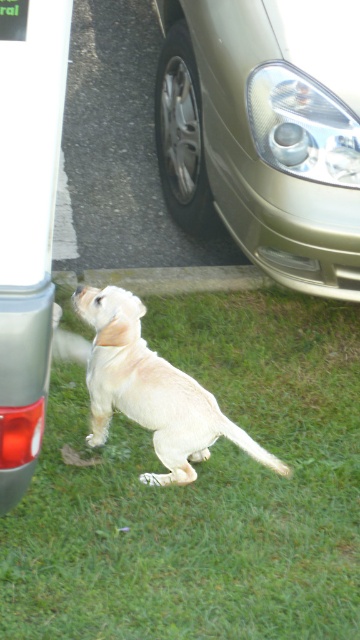
You are a photographer trying to capture the light beige fur dog at center and the gold metallic car at upper center in a single frame. Based on their positions, which object is located to the right of the other?

The gold metallic car at upper center is positioned on the right side of light beige fur dog at center, so the car is to the right of the dog.

What are the coordinates of the metallic gold car at center?

The metallic gold car at center is located at coordinates point (28, 221).

You are a photographer wanting to capture the light beige fur dog at center and the green grass at lower center in a single frame. Given that the camera can only focus on one subject at a time, which subject should you choose to ensure the larger one is in focus?

The green grass at lower center is larger in size than the light beige fur dog at center, so you should focus on the green grass at lower center to ensure the larger subject is in focus.